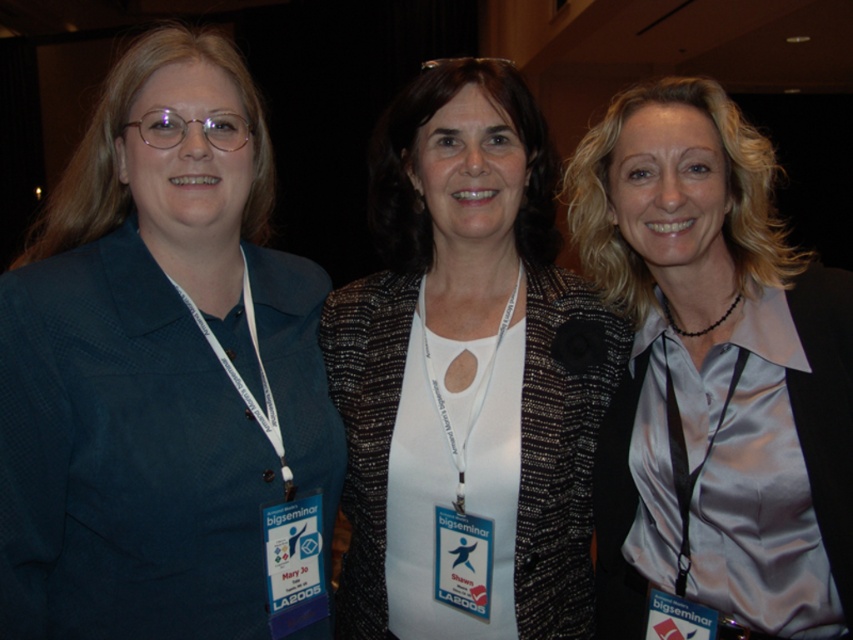
Question: Which is nearer to the speckled woolen jacket at center?

Choices:
 (A) matte blue blazer at left
 (B) satin light gray blouse at center

Answer: (B)

Question: Considering the relative positions of matte blue blazer at left and satin light gray blouse at center in the image provided, where is matte blue blazer at left located with respect to satin light gray blouse at center?

Choices:
 (A) left
 (B) right

Answer: (A)

Question: Among these objects, which one is nearest to the camera?

Choices:
 (A) satin light gray blouse at center
 (B) matte blue blazer at left

Answer: (B)

Question: Is speckled woolen jacket at center further to camera compared to satin light gray blouse at center?

Choices:
 (A) no
 (B) yes

Answer: (B)

Question: Which point is farther to the camera?

Choices:
 (A) matte blue blazer at left
 (B) satin light gray blouse at center
 (C) speckled woolen jacket at center

Answer: (C)

Question: Can you confirm if speckled woolen jacket at center is positioned below satin light gray blouse at center?

Choices:
 (A) no
 (B) yes

Answer: (B)